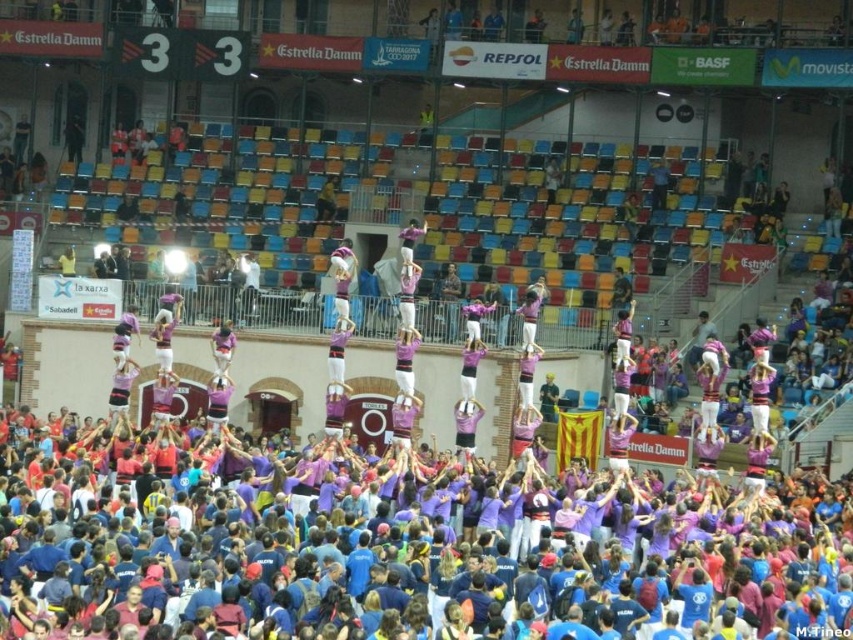
You are a photographer standing at the edge of the arena. You want to take a photo of the purple cotton crowd at center and the purple fabric person at center. According to the scene, which one is on the right side when facing the image?

The purple cotton crowd at center is positioned on the right side of the purple fabric person at center, so when facing the image, the purple cotton crowd at center is on the right side.

You are a drone operator tasked with capturing aerial footage of the human tower. The purple cotton crowd at center is the base of the tower, and the purple fabric human at center is the topmost person. To ensure the entire tower is in frame, what is the minimum height you need to ascend to?

The minimum height required to capture the entire tower in frame would be at least 13.69 meters, as this is the distance between the purple cotton crowd at center and the purple fabric human at center.